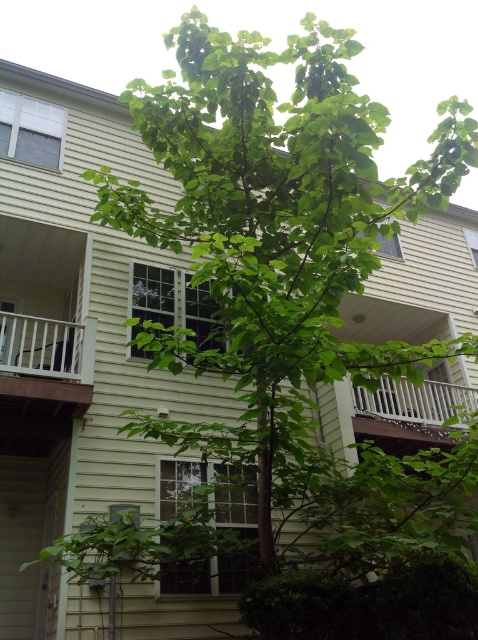
You are standing 5 meters away from the residential building. A point at coordinate point is located at point (12, 392). Can you determine if you are closer to the residential building than the point?

The distance of point (12, 392) from viewer is 5.45 meters. Since you are standing 5 meters away from the residential building, you are closer to the building than the point.

You are standing in front of the residential building and want to take a photo of the two points mentioned. Which point, point (85, 332) or point (412, 419), will appear larger in your camera view?

Point (85, 332) will appear larger in the camera view because it is closer to the camera than point (412, 419).